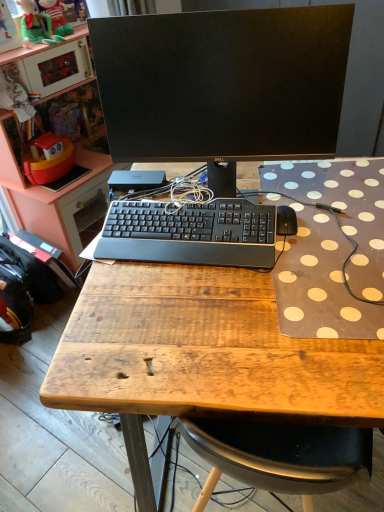
I want to click on free space above wooden desk at center (from a real-world perspective), so click(259, 251).